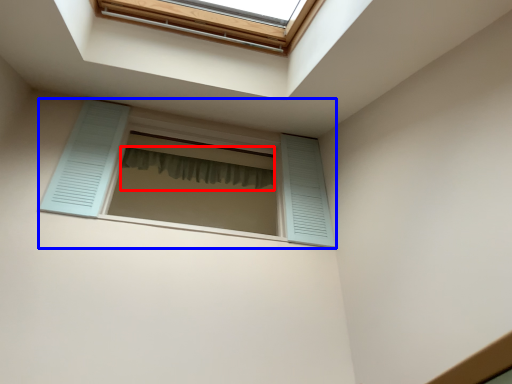
Question: Which of the following is the farthest to the observer, shower curtain (highlighted by a red box) or window (highlighted by a blue box)?

Choices:
 (A) shower curtain
 (B) window

Answer: (A)